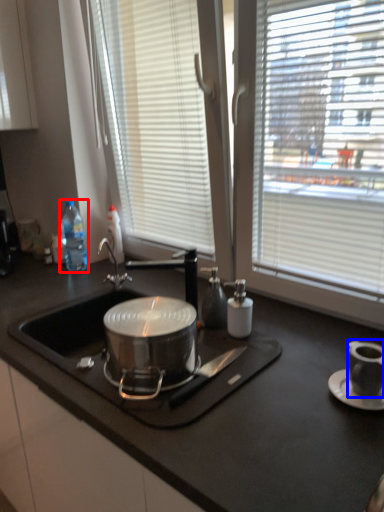
Question: Which object appears closest to the camera in this image, bottle (highlighted by a red box) or appliance (highlighted by a blue box)?

Choices:
 (A) bottle
 (B) appliance

Answer: (B)